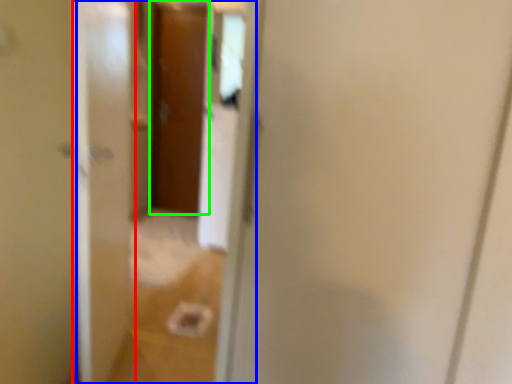
Question: Considering the real-world distances, which object is closest to screen door (highlighted by a red box)? glass door (highlighted by a blue box) or door (highlighted by a green box).

Choices:
 (A) glass door
 (B) door

Answer: (A)